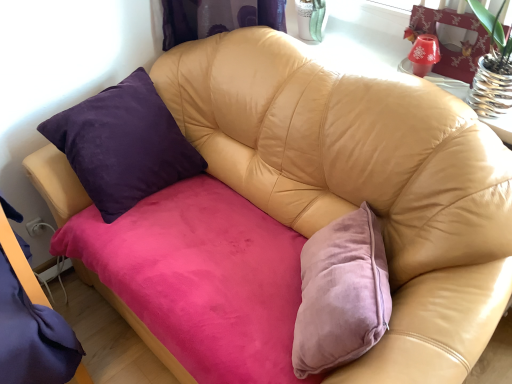
Question: Considering the relative positions of purple velvet bed frame at left and translucent glass vase at upper right in the image provided, is purple velvet bed frame at left to the left or to the right of translucent glass vase at upper right?

Choices:
 (A) right
 (B) left

Answer: (B)

Question: From a real-world perspective, relative to translucent glass vase at upper right, is purple velvet bed frame at left vertically above or below?

Choices:
 (A) above
 (B) below

Answer: (B)

Question: From the image's perspective, is purple velvet bed frame at left located above or below translucent glass vase at upper right?

Choices:
 (A) below
 (B) above

Answer: (A)

Question: From a real-world perspective, relative to purple velvet bed frame at left, is translucent glass vase at upper right vertically above or below?

Choices:
 (A) below
 (B) above

Answer: (B)

Question: Visually, is translucent glass vase at upper right positioned to the left or to the right of purple velvet bed frame at left?

Choices:
 (A) right
 (B) left

Answer: (A)

Question: Would you say translucent glass vase at upper right is inside or outside purple velvet bed frame at left?

Choices:
 (A) outside
 (B) inside

Answer: (A)

Question: Considering the positions of translucent glass vase at upper right and purple velvet bed frame at left in the image, is translucent glass vase at upper right wider or thinner than purple velvet bed frame at left?

Choices:
 (A) wide
 (B) thin

Answer: (B)